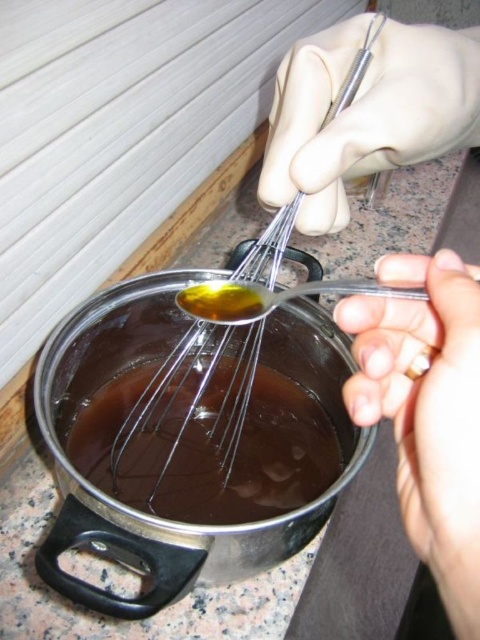
Question: Does smooth skin hand at center appear under white latex glove at upper center?

Choices:
 (A) yes
 (B) no

Answer: (A)

Question: Is smooth skin hand at center below metallic whisk at center?

Choices:
 (A) no
 (B) yes

Answer: (B)

Question: Which point is farther to the camera?

Choices:
 (A) (328, 156)
 (B) (371, 92)

Answer: (B)

Question: Which point is farther from the camera taking this photo?

Choices:
 (A) (399, 464)
 (B) (451, 308)

Answer: (A)

Question: Is smooth skin hand at center to the right of metallic whisk at center from the viewer's perspective?

Choices:
 (A) yes
 (B) no

Answer: (A)

Question: Which point appears closest to the camera in this image?

Choices:
 (A) (298, 214)
 (B) (454, 605)
 (C) (231, 387)
 (D) (463, 577)

Answer: (D)